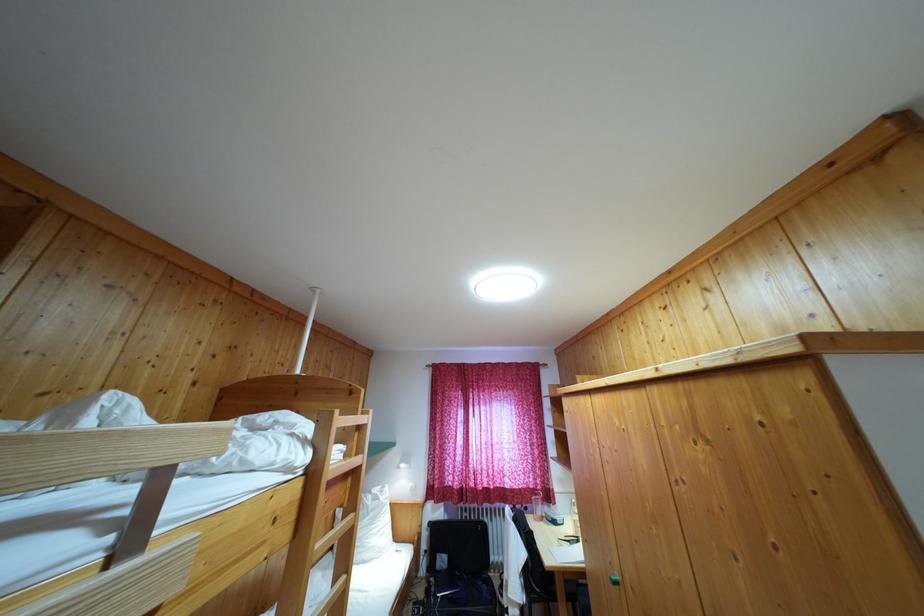
Where would you stepping on the wooden ladder rung? Please return your answer as a coordinate pair (x, y).

(336, 469)